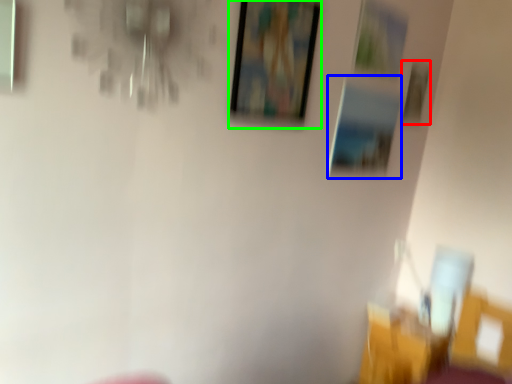
Question: Estimate the real-world distances between objects in this image. Which object is farther from picture frame (highlighted by a red box), picture frame (highlighted by a blue box) or picture frame (highlighted by a green box)?

Choices:
 (A) picture frame
 (B) picture frame

Answer: (B)